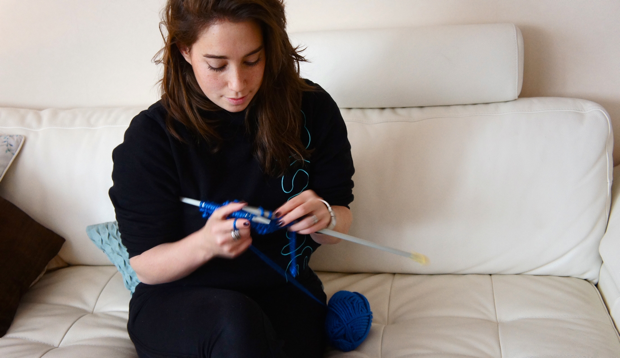
Identify the location of white seat cushion. (x=516, y=321).